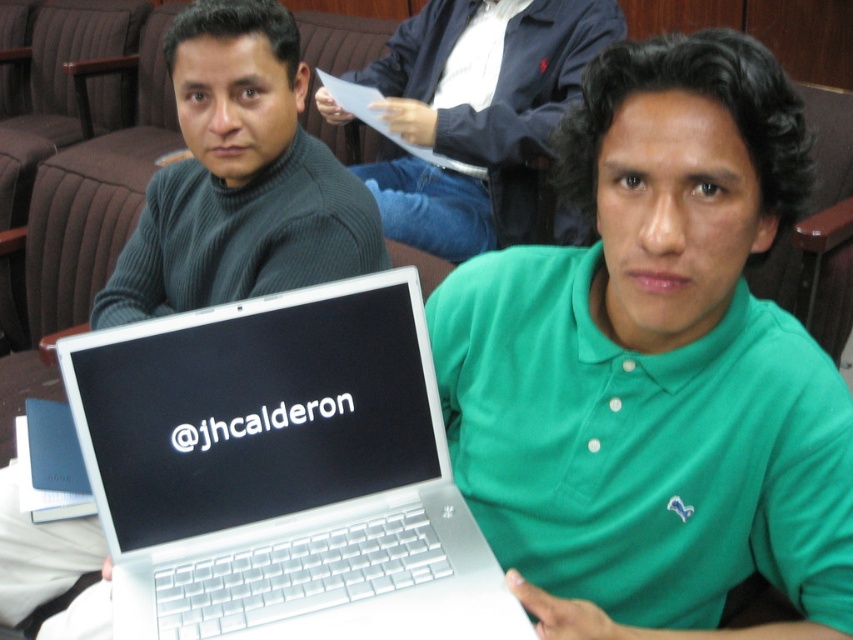
Who is lower down, matte gray sweater at left or dark blue jacket at upper center?

matte gray sweater at left is below.

Is point (148, 211) more distant than point (381, 196)?

No.

Locate an element on the screen. The width and height of the screenshot is (853, 640). matte gray sweater at left is located at coordinates click(x=239, y=179).

Can you confirm if silver metallic laptop at center is taller than matte gray sweater at left?

No.

Does silver metallic laptop at center have a smaller size compared to matte gray sweater at left?

Yes, silver metallic laptop at center is smaller than matte gray sweater at left.

Locate an element on the screen. silver metallic laptop at center is located at coordinates (282, 474).

Is silver metallic laptop at center to the right of dark blue jacket at upper center from the viewer's perspective?

In fact, silver metallic laptop at center is to the left of dark blue jacket at upper center.

Does point (379, 417) lie in front of point (364, 179)?

Yes.

The height and width of the screenshot is (640, 853). Identify the location of silver metallic laptop at center. (282, 474).